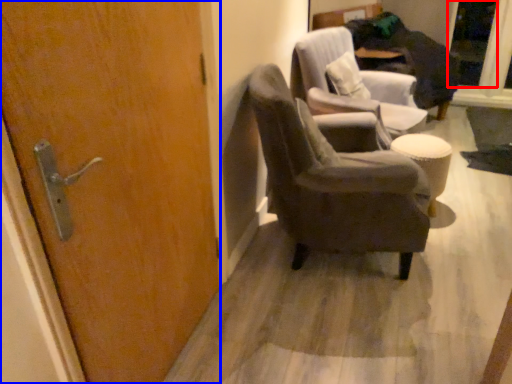
Question: Which object appears closest to the camera in this image, glass door (highlighted by a red box) or door (highlighted by a blue box)?

Choices:
 (A) glass door
 (B) door

Answer: (B)